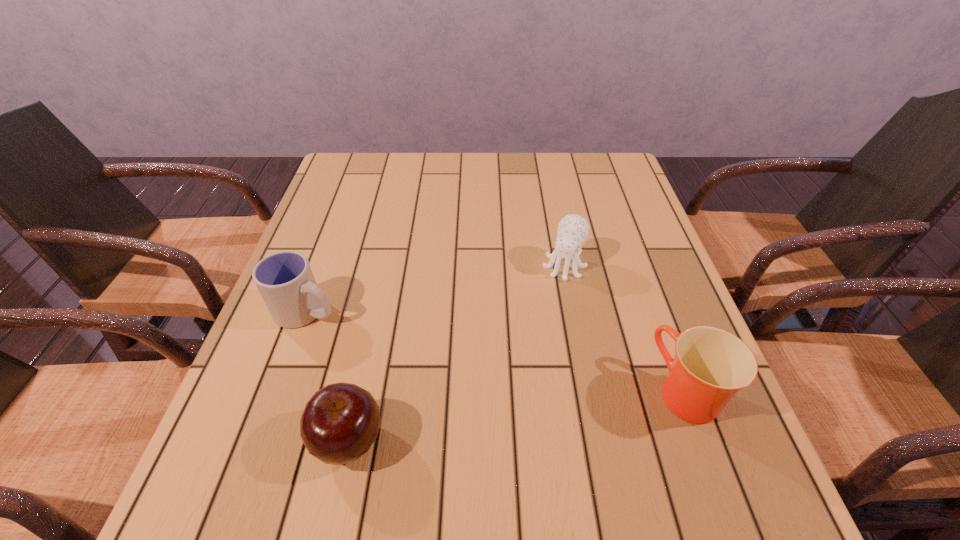
You are a GUI agent. You are given a task and a screenshot of the screen. Output one action in this format:
    pyautogui.click(x=<x>, y=<y>)
    Task: Click on the free area in between the farthest object and the right cup
    Image resolution: width=960 pixels, height=540 pixels.
    Given the screenshot: What is the action you would take?
    pyautogui.click(x=625, y=329)

I want to click on unoccupied position between the right cup and the third object from right to left, so click(x=517, y=416).

Locate an element on the screen. free space between the third object from left to right and the right cup is located at coordinates (625, 329).

Where is `vacant space that's between the nearer cup and the octopus`? vacant space that's between the nearer cup and the octopus is located at coordinates (625, 329).

I want to click on vacant area that lies between the nearer cup and the farther cup, so click(x=497, y=350).

Identify the location of object that ranks as the closest to the second object from right to left. (711, 365).

Locate which object ranks third in proximity to the second farthest object. Please provide its 2D coordinates. Your answer should be formatted as a tuple, i.e. [(x, y)], where the tuple contains the x and y coordinates of a point satisfying the conditions above.

[(711, 365)]

This screenshot has height=540, width=960. I want to click on free region that satisfies the following two spatial constraints: 1. on the back side of the second object from right to left; 2. on the right side of the apple, so click(x=387, y=266).

The image size is (960, 540). I want to click on vacant position in the image that satisfies the following two spatial constraints: 1. on the back side of the third object from left to right; 2. on the right side of the third object from right to left, so click(x=387, y=266).